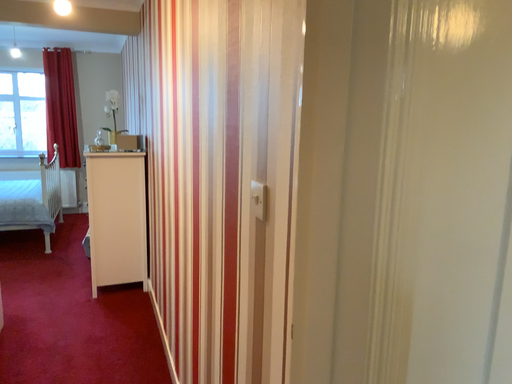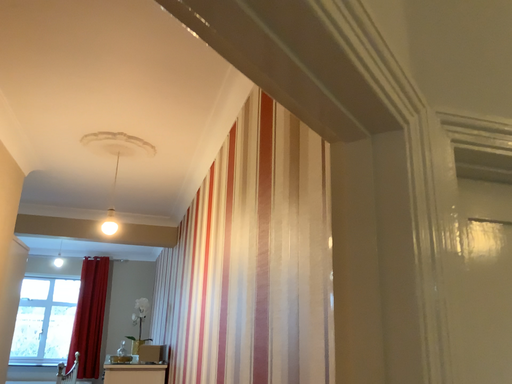
Question: Which way did the camera rotate in the video?

Choices:
 (A) rotated upward
 (B) rotated downward

Answer: (A)